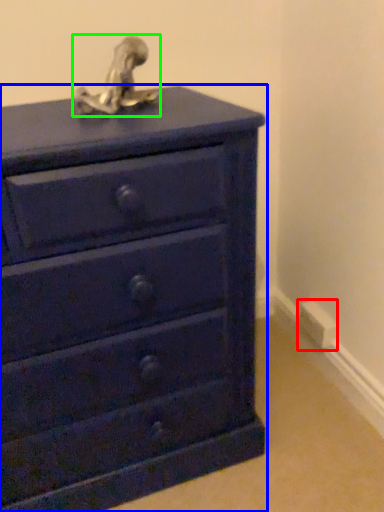
Question: Which object is positioned farthest from electric outlet (highlighted by a red box)? Select from chest of drawers (highlighted by a blue box) and sculpture (highlighted by a green box).

Choices:
 (A) chest of drawers
 (B) sculpture

Answer: (B)